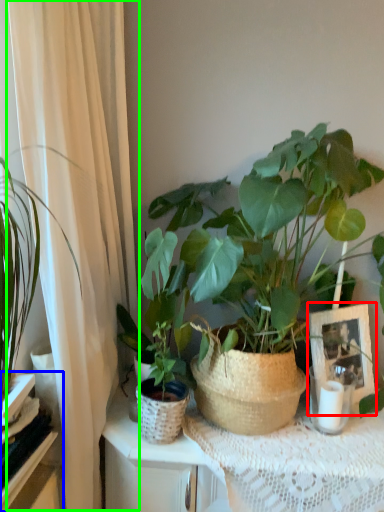
Question: Based on their relative distances, which object is nearer to picture frame (highlighted by a red box)? Choose from shelf (highlighted by a blue box) and curtain (highlighted by a green box).

Choices:
 (A) shelf
 (B) curtain

Answer: (B)